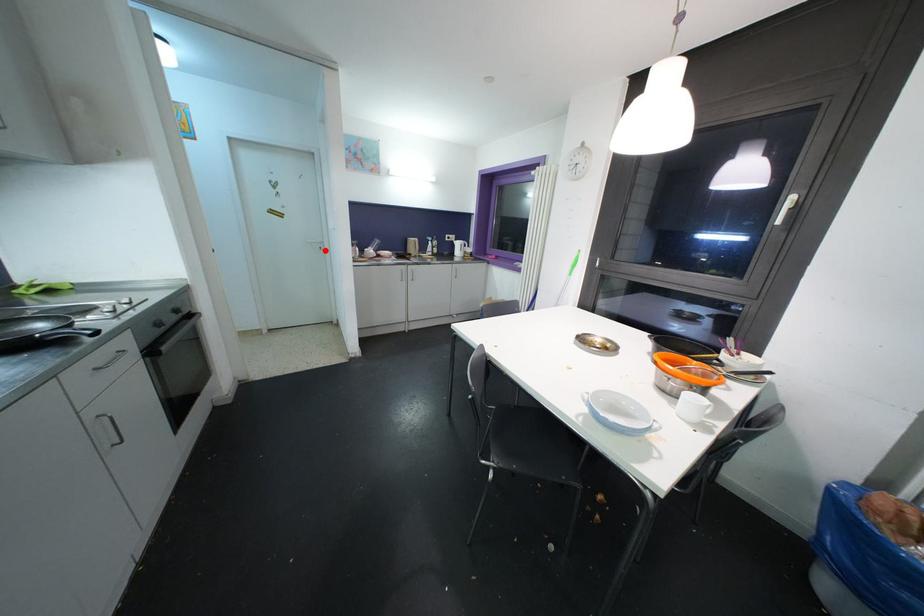
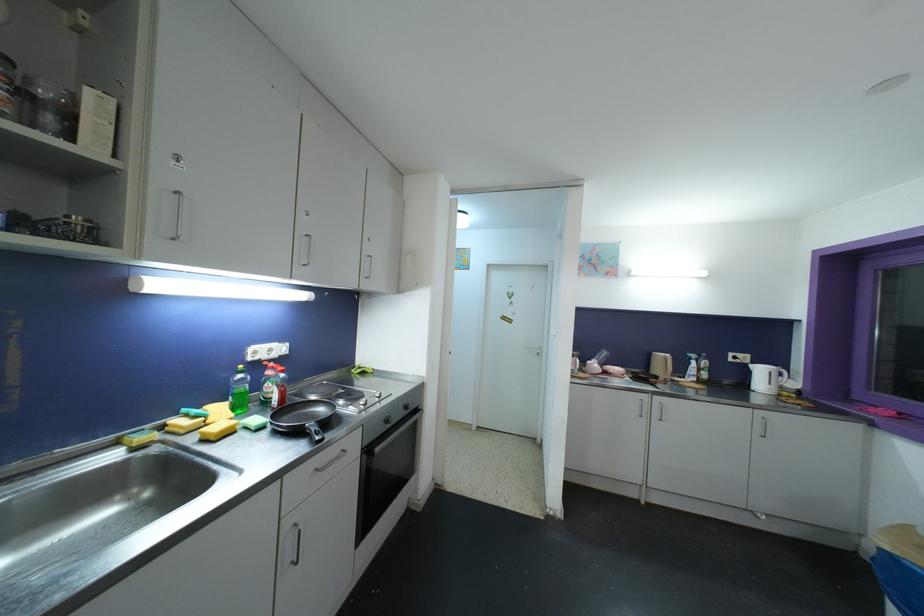
The point at the highlighted location is marked in the first image. Where is the corresponding point in the second image?

(542, 357)